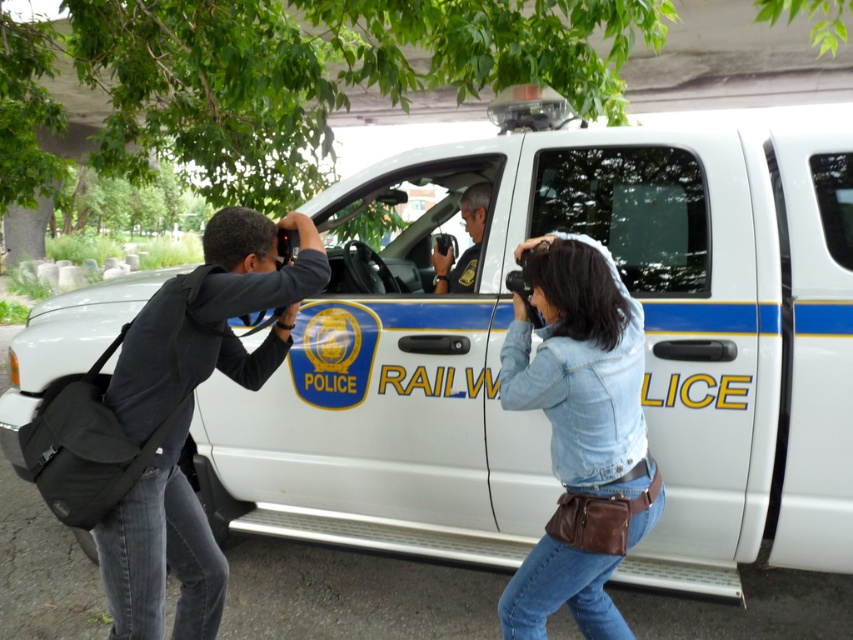
You are a photographer trying to capture both the dark gray hoodie at left and the matte black uniform at center in a single frame. Given their sizes, which one will appear bigger in the photo?

The dark gray hoodie at left will appear bigger in the photo since it is larger in size than the matte black uniform at center.

You are a photographer trying to capture a photo of the white police vehicle. You have two cameras. One is on your neck strap and the other is in your hand. You are standing at the dark gray hoodie at left. Your colleague is at the matte black uniform at center. The distance between you is 1.26 meters. Can you and your colleague both take a photo of the police vehicle at the same time without moving?

Yes, both the dark gray hoodie at left and the matte black uniform at center can take a photo of the police vehicle simultaneously since they are only 1.26 meters apart, allowing them to operate their cameras without interfering with each other.